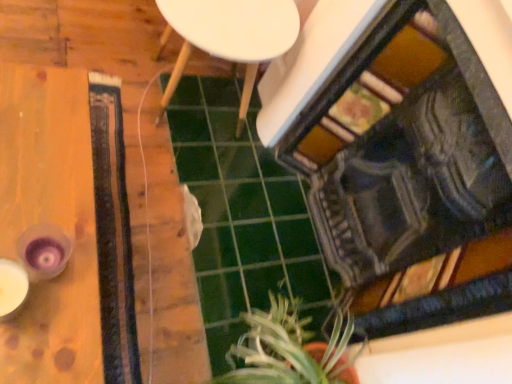
The width and height of the screenshot is (512, 384). I want to click on wooden table at left, so click(x=49, y=226).

Is white matte side table at center aimed at green leafy plant at lower center?

No, white matte side table at center is not oriented towards green leafy plant at lower center.

Is white matte side table at center wider or thinner than green leafy plant at lower center?

white matte side table at center is wider than green leafy plant at lower center.

From the picture: Is green leafy plant at lower center a part of white matte side table at center?

No, green leafy plant at lower center is not a part of white matte side table at center.

Measure the distance from white matte side table at center to green leafy plant at lower center.

white matte side table at center is 31.48 inches from green leafy plant at lower center.

At what (x,y) coordinates should I click in order to perform the action: click on table on the left of green leafy plant at lower center. Please return your answer as a coordinate pair (x, y). This screenshot has width=512, height=384. Looking at the image, I should click on (49, 226).

Looking at the image, does wooden table at left seem bigger or smaller compared to green leafy plant at lower center?

wooden table at left is bigger than green leafy plant at lower center.

Between wooden table at left and green leafy plant at lower center, which one has more height?

green leafy plant at lower center is taller.

In the image, is wooden table at left positioned in front of or behind green leafy plant at lower center?

wooden table at left is positioned closer to the viewer than green leafy plant at lower center.

Is green leafy plant at lower center inside the boundaries of white matte side table at center, or outside?

green leafy plant at lower center is not inside white matte side table at center, it's outside.

From a real-world perspective, relative to white matte side table at center, is green leafy plant at lower center vertically above or below?

green leafy plant at lower center is situated lower than white matte side table at center in the real world.

Are green leafy plant at lower center and white matte side table at center located far from each other?

green leafy plant at lower center is near white matte side table at center, not far away.

Is green leafy plant at lower center smaller than white matte side table at center?

Indeed, green leafy plant at lower center has a smaller size compared to white matte side table at center.

Is white matte side table at center bigger than wooden table at left?

Yes.

From the image's perspective, which is above, white matte side table at center or wooden table at left?

white matte side table at center, from the image's perspective.

From a real-world perspective, which object rests below the other?

wooden table at left is physically lower.

How much distance is there between white matte side table at center and wooden table at left?

22.98 inches.

From the image's perspective, is green leafy plant at lower center on top of wooden table at left?

Incorrect, from the image's perspective, green leafy plant at lower center is lower than wooden table at left.

Does green leafy plant at lower center have a lesser width compared to wooden table at left?

Yes.

Is point (339, 331) positioned after point (73, 327)?

Yes, it is.

How far apart are green leafy plant at lower center and wooden table at left?

green leafy plant at lower center and wooden table at left are 23.51 inches apart from each other.

Which object is further away from the camera taking this photo, wooden table at left or white matte side table at center?

white matte side table at center is further away from the camera.

Considering the relative positions of wooden table at left and white matte side table at center in the image provided, is wooden table at left to the left of white matte side table at center from the viewer's perspective?

Correct, you'll find wooden table at left to the left of white matte side table at center.

From the picture: Is wooden table at left oriented towards white matte side table at center?

No, wooden table at left is not turned towards white matte side table at center.

From a real-world perspective, is wooden table at left beneath white matte side table at center?

Yes, from a real-world perspective, wooden table at left is beneath white matte side table at center.

You are a GUI agent. You are given a task and a screenshot of the screen. Output one action in this format:
    pyautogui.click(x=<x>, y=<y>)
    Task: Click on the houseplant beneath the white matte side table at center (from a real-world perspective)
    
    Given the screenshot: What is the action you would take?
    pyautogui.click(x=289, y=349)

Locate an element on the screen. The height and width of the screenshot is (384, 512). houseplant below the wooden table at left (from the image's perspective) is located at coordinates (289, 349).

When comparing their distances from wooden table at left, does white matte side table at center or green leafy plant at lower center seem closer?

The object closer to wooden table at left is white matte side table at center.

Based on their spatial positions, is wooden table at left or green leafy plant at lower center further from white matte side table at center?

green leafy plant at lower center is further to white matte side table at center.

Considering their positions, is white matte side table at center positioned further to green leafy plant at lower center than wooden table at left?

The object further to green leafy plant at lower center is white matte side table at center.

Estimate the real-world distances between objects in this image. Which object is further from white matte side table at center, green leafy plant at lower center or wooden table at left?

Based on the image, green leafy plant at lower center appears to be further to white matte side table at center.

Based on their spatial positions, is wooden table at left or white matte side table at center further from green leafy plant at lower center?

white matte side table at center is positioned further to the anchor green leafy plant at lower center.

Which object lies nearer to the anchor point wooden table at left, green leafy plant at lower center or white matte side table at center?

The object closer to wooden table at left is white matte side table at center.

At what (x,y) coordinates should I click in order to perform the action: click on table between white matte side table at center and green leafy plant at lower center vertically. Please return your answer as a coordinate pair (x, y). This screenshot has height=384, width=512. Looking at the image, I should click on (49, 226).